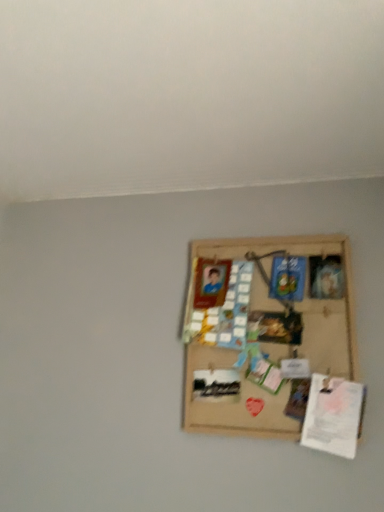
Question: Does burlap board at center come behind white paper at lower right?

Choices:
 (A) yes
 (B) no

Answer: (A)

Question: Is burlap board at center placed right next to white paper at lower right?

Choices:
 (A) yes
 (B) no

Answer: (B)

Question: From a real-world perspective, is burlap board at center on top of white paper at lower right?

Choices:
 (A) yes
 (B) no

Answer: (A)

Question: Could you tell me if burlap board at center is facing white paper at lower right?

Choices:
 (A) yes
 (B) no

Answer: (A)

Question: Is burlap board at center thinner than white paper at lower right?

Choices:
 (A) no
 (B) yes

Answer: (B)

Question: Can you confirm if burlap board at center is smaller than white paper at lower right?

Choices:
 (A) yes
 (B) no

Answer: (B)

Question: Can you confirm if white paper at lower right is thinner than burlap board at center?

Choices:
 (A) no
 (B) yes

Answer: (A)

Question: Is white paper at lower right not within burlap board at center?

Choices:
 (A) no
 (B) yes

Answer: (A)

Question: Considering the relative sizes of white paper at lower right and burlap board at center in the image provided, is white paper at lower right wider than burlap board at center?

Choices:
 (A) yes
 (B) no

Answer: (A)

Question: Is white paper at lower right positioned before burlap board at center?

Choices:
 (A) yes
 (B) no

Answer: (A)

Question: Can you confirm if white paper at lower right is positioned to the left of burlap board at center?

Choices:
 (A) no
 (B) yes

Answer: (A)

Question: Can you confirm if white paper at lower right is positioned to the right of burlap board at center?

Choices:
 (A) yes
 (B) no

Answer: (A)

Question: In terms of height, does burlap board at center look taller or shorter compared to white paper at lower right?

Choices:
 (A) short
 (B) tall

Answer: (B)